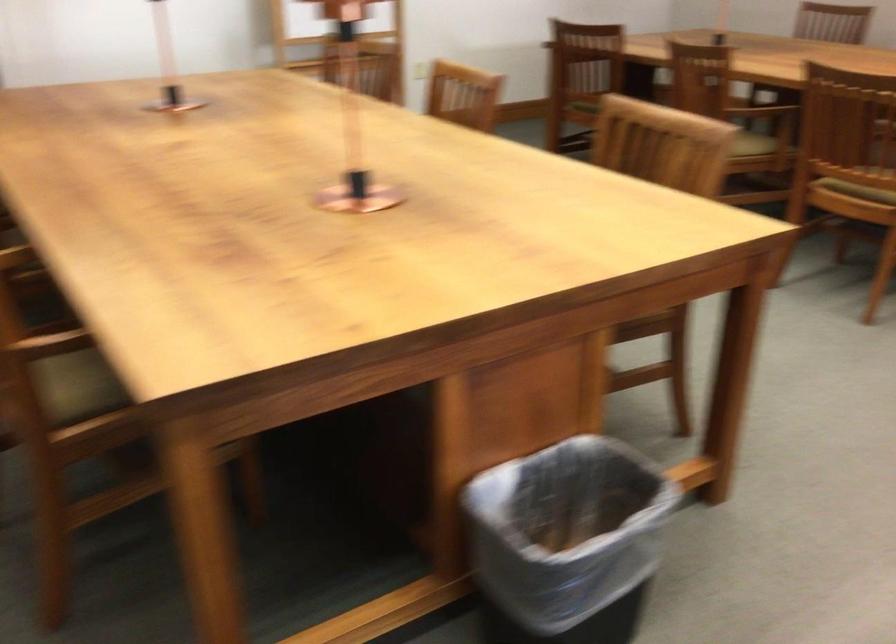
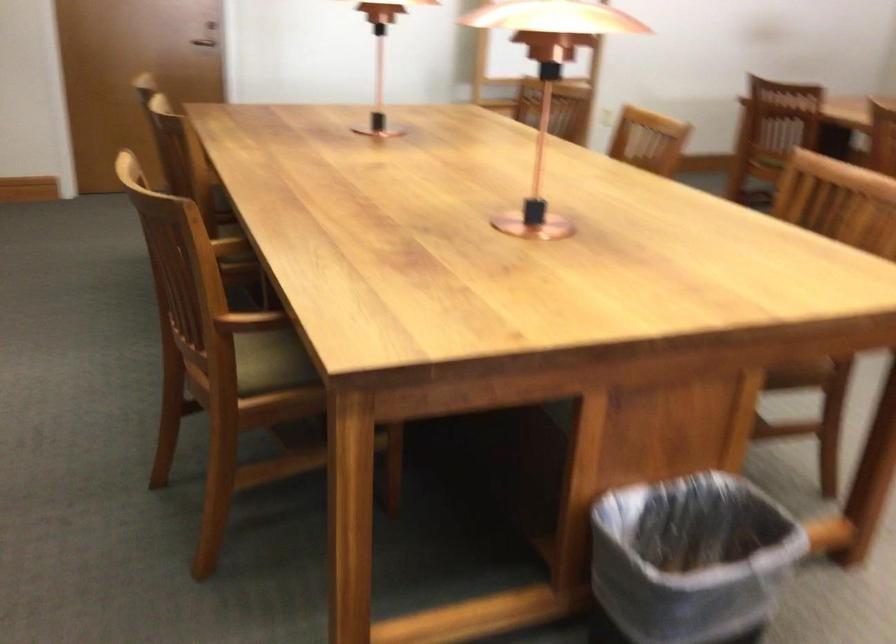
In the second image, find the point that corresponds to pixel 567 521 in the first image.

(691, 560)